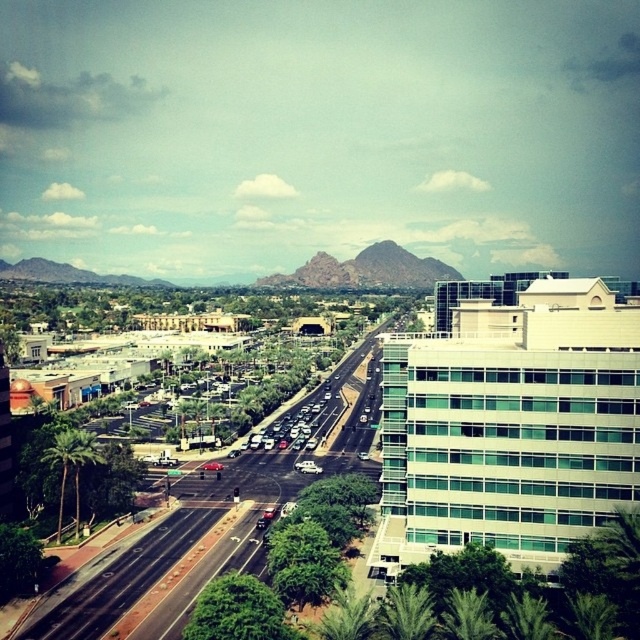
Which is in front, point (328, 269) or point (385, 627)?

Positioned in front is point (385, 627).

Is rugged rock formation at center closer to camera compared to green leafy palm tree at lower center?

No, rugged rock formation at center is behind green leafy palm tree at lower center.

Is point (416, 268) in front of point (388, 604)?

No, it is behind (388, 604).

The width and height of the screenshot is (640, 640). What are the coordinates of `rugged rock formation at center` in the screenshot? It's located at (365, 269).

Who is shorter, dark asphalt highway at center or green leafy palm tree at lower right?

green leafy palm tree at lower right is shorter.

Between dark asphalt highway at center and green leafy palm tree at lower right, which one is positioned lower?

Positioned lower is green leafy palm tree at lower right.

Does point (100, 592) lie in front of point (445, 632)?

No, it is not.

I want to click on dark asphalt highway at center, so click(x=156, y=548).

Does dark asphalt highway at center have a smaller size compared to green leafy palm tree at lower left?

No, dark asphalt highway at center is not smaller than green leafy palm tree at lower left.

Between dark asphalt highway at center and green leafy palm tree at lower left, which one has less height?

With less height is green leafy palm tree at lower left.

The height and width of the screenshot is (640, 640). What are the coordinates of `dark asphalt highway at center` in the screenshot? It's located at (156, 548).